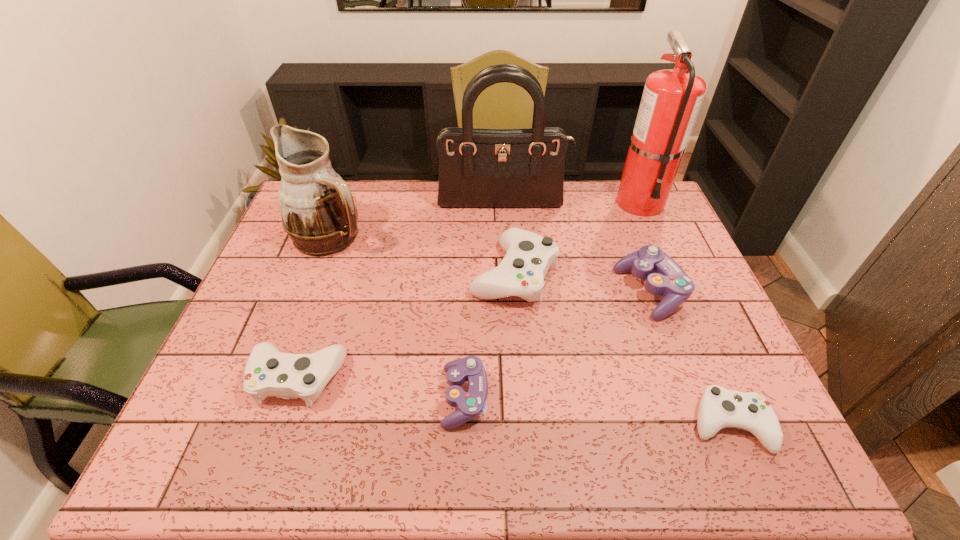
Find the location of a particular element. The image size is (960, 540). blank region between the smallest white control and the fire extinguisher is located at coordinates (684, 313).

Where is `vacant area that lies between the fire extinguisher and the black handbag`? The width and height of the screenshot is (960, 540). vacant area that lies between the fire extinguisher and the black handbag is located at coordinates (571, 203).

This screenshot has height=540, width=960. What are the coordinates of `free area in between the black handbag and the smallest white control` in the screenshot? It's located at (616, 314).

Locate which object ranks second in proximity to the pitcher. Please provide its 2D coordinates. Your answer should be formatted as a tuple, i.e. [(x, y)], where the tuple contains the x and y coordinates of a point satisfying the conditions above.

[(528, 257)]

Find the location of `object that is the fourth closest to the pitcher`. object that is the fourth closest to the pitcher is located at coordinates (470, 405).

Locate an element on the screen. The height and width of the screenshot is (540, 960). control that is the fourth closest to the right purple control is located at coordinates (268, 372).

Locate which control ranks in proximity to the brown pitcher. Please provide its 2D coordinates. Your answer should be formatted as a tuple, i.e. [(x, y)], where the tuple contains the x and y coordinates of a point satisfying the conditions above.

[(528, 257)]

Image resolution: width=960 pixels, height=540 pixels. Identify the location of white control object that ranks as the third closest to the fire extinguisher. (268, 372).

Find the location of a particular element. Image resolution: width=960 pixels, height=540 pixels. white control that can be found as the second closest to the handbag is located at coordinates (268, 372).

This screenshot has width=960, height=540. Identify the location of free space that satisfies the following two spatial constraints: 1. from the spout of the third tallest object; 2. on the right side of the farther purple control. (311, 292).